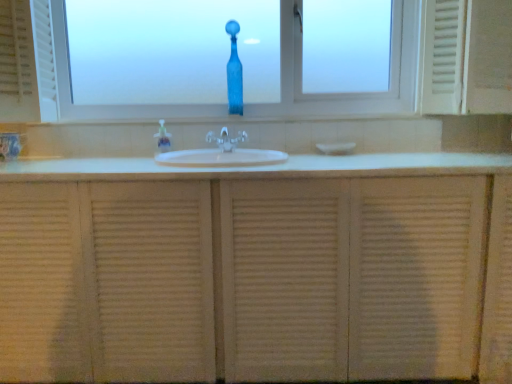
Question: In the image, is white textured cabinet at center positioned in front of or behind translucent plastic soap dispenser at center?

Choices:
 (A) behind
 (B) front

Answer: (B)

Question: Based on their sizes in the image, would you say white textured cabinet at center is bigger or smaller than translucent plastic soap dispenser at center?

Choices:
 (A) big
 (B) small

Answer: (A)

Question: Based on their relative distances, which object is nearer to the transparent glass window at center?

Choices:
 (A) clear plastic faucet at center
 (B) white textured cabinet at center
 (C) white ceramic sink at center
 (D) white textured medicine cabinet at right
 (E) blue glass vase at center

Answer: (D)

Question: Considering the real-world distances, which object is farthest from the white ceramic sink at center?

Choices:
 (A) white textured cabinet at center
 (B) translucent plastic soap dispenser at center
 (C) clear plastic faucet at center
 (D) blue glass vase at center
 (E) white textured medicine cabinet at right

Answer: (E)